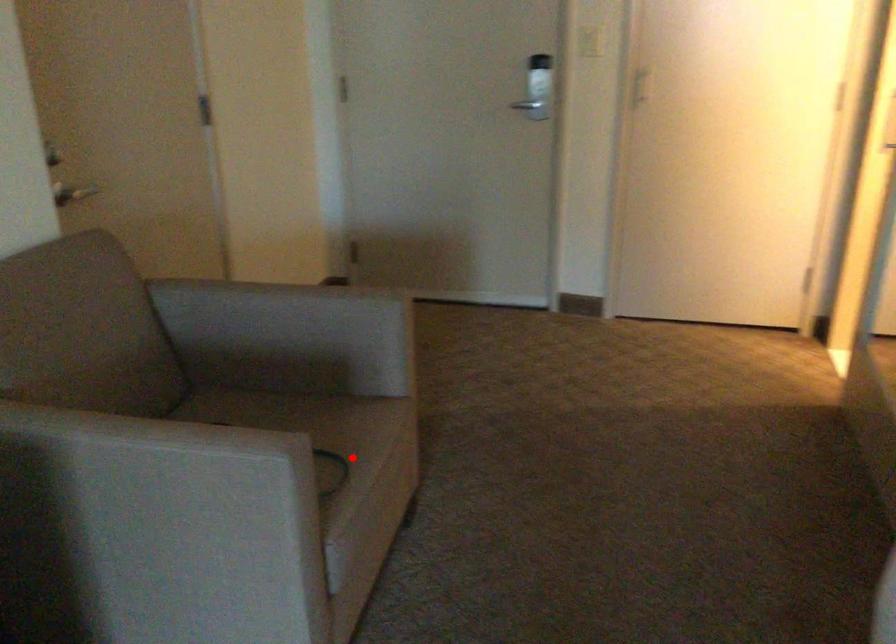
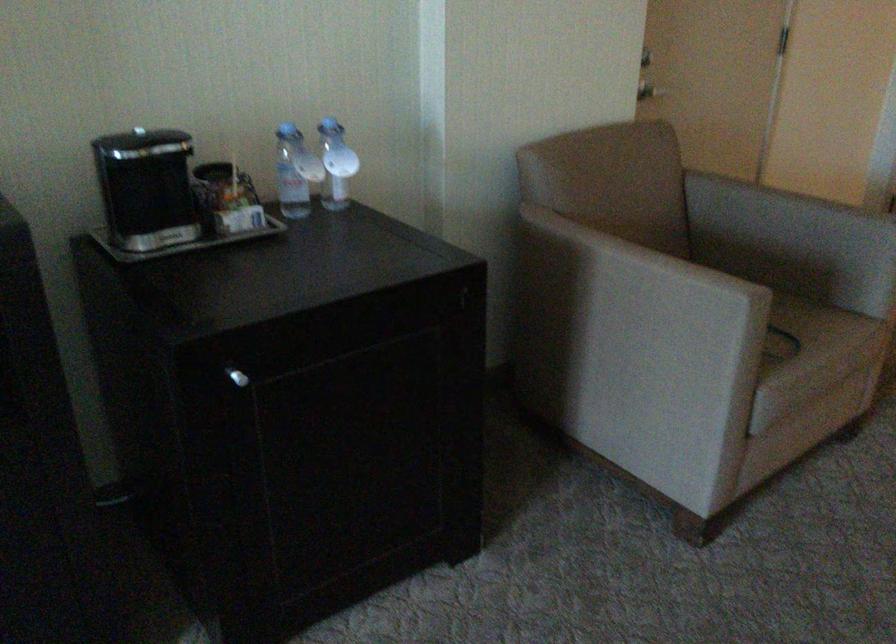
Question: A red point is marked in image1. In image2, is the corresponding 3D point closer to the camera or farther? Reply with the corresponding letter.

Choices:
 (A) The corresponding 3D point is closer.
 (B) The corresponding 3D point is farther.

Answer: (B)